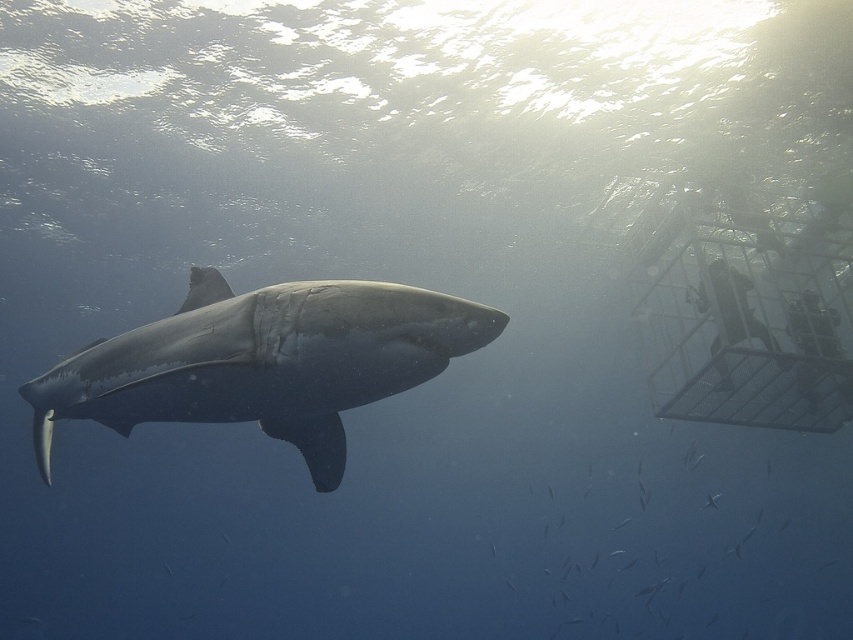
Question: Can you confirm if metallic silver birdcage at right is positioned to the right of black rubber wetsuit at right?

Choices:
 (A) yes
 (B) no

Answer: (A)

Question: Is metallic silver birdcage at right below metallic silver cage at right?

Choices:
 (A) yes
 (B) no

Answer: (B)

Question: Among these points, which one is nearest to the camera?

Choices:
 (A) (732, 326)
 (B) (796, 312)
 (C) (310, 380)

Answer: (C)

Question: Is the position of shiny gray shark at center more distant than that of metallic silver cage at right?

Choices:
 (A) no
 (B) yes

Answer: (A)

Question: Which point is closer to the camera taking this photo?

Choices:
 (A) (727, 292)
 (B) (323, 321)
 (C) (828, 337)
 (D) (694, 289)

Answer: (B)

Question: Based on their relative distances, which object is farther from the metallic silver cage at right?

Choices:
 (A) metallic silver birdcage at right
 (B) black rubber wetsuit at right

Answer: (A)